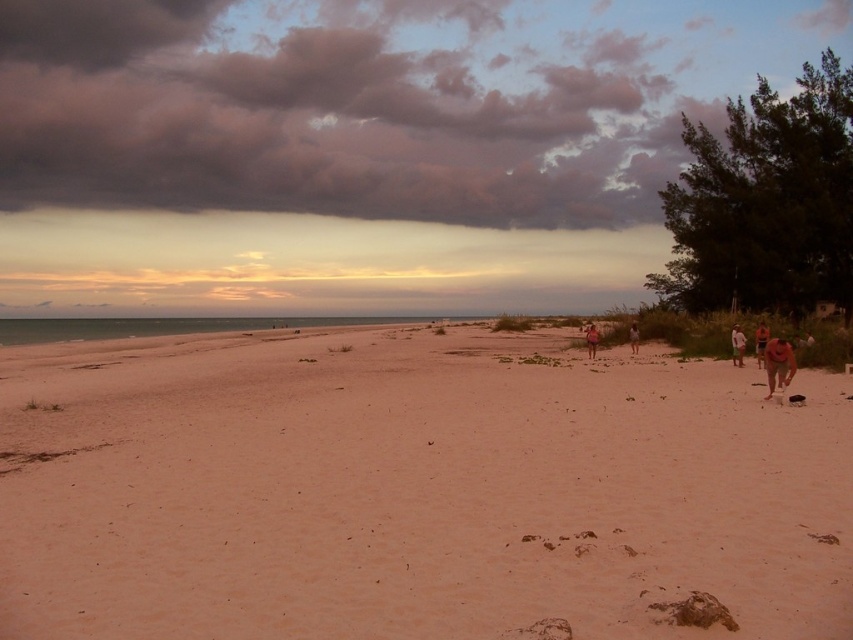
Is the position of sandy beach at center more distant than that of pink fabric person at center?

No, it is not.

Does sandy beach at center lie in front of pink fabric person at center?

Yes, it is in front of pink fabric person at center.

You are a GUI agent. You are given a task and a screenshot of the screen. Output one action in this format:
    pyautogui.click(x=<x>, y=<y>)
    Task: Click on the sandy beach at center
    This screenshot has height=640, width=853.
    Given the screenshot: What is the action you would take?
    pyautogui.click(x=412, y=490)

Can you confirm if sandy beach at center is positioned to the right of dark pink fluffy cloud at upper center?

Correct, you'll find sandy beach at center to the right of dark pink fluffy cloud at upper center.

Does sandy beach at center come behind dark pink fluffy cloud at upper center?

No, sandy beach at center is closer to the viewer.

Who is more forward, (825, 509) or (207, 104)?

Point (825, 509)

Where is `sandy beach at center`? sandy beach at center is located at coordinates (412, 490).

Which is in front, point (735, 330) or point (637, 333)?

Point (735, 330) is more forward.

The image size is (853, 640). Find the location of `green fabric shorts at right`. green fabric shorts at right is located at coordinates (737, 344).